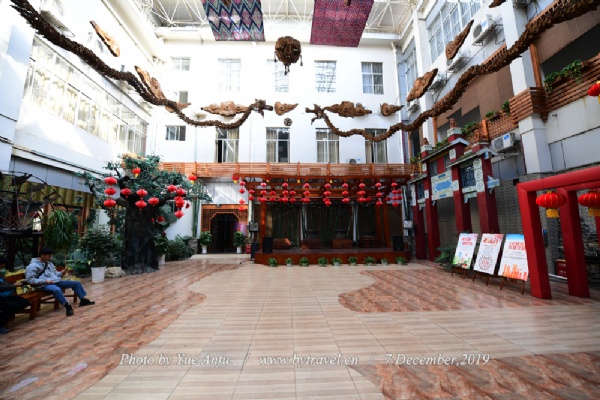
The image size is (600, 400). What are the coordinates of `bench` in the screenshot? It's located at (24, 301).